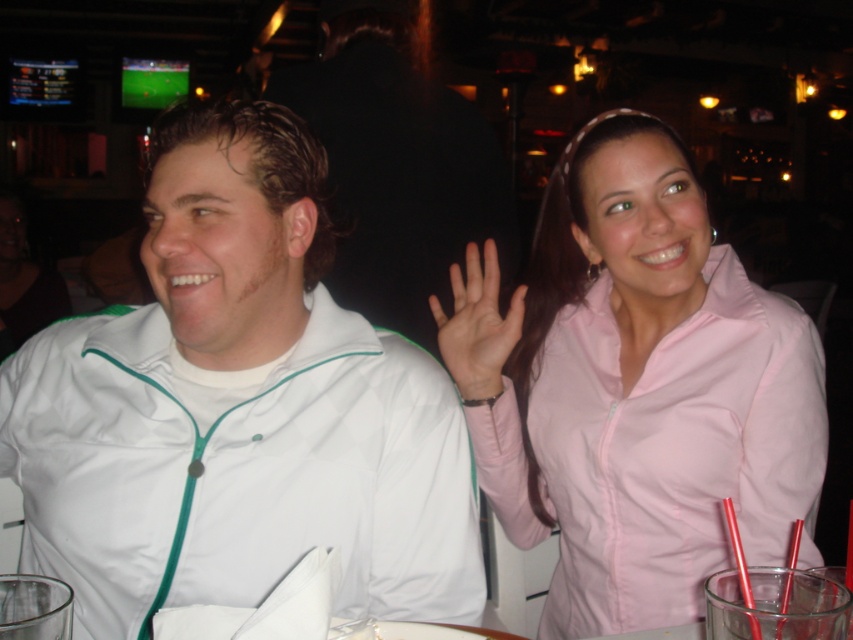
Question: Can you confirm if white matte jacket at left is smaller than pink matte hand at center?

Choices:
 (A) yes
 (B) no

Answer: (B)

Question: Estimate the real-world distances between objects in this image. Which object is closer to the pink zip-up jacket at upper right?

Choices:
 (A) white matte jacket at left
 (B) pink matte hand at center

Answer: (B)

Question: Does pink zip-up jacket at upper right appear over pink matte hand at center?

Choices:
 (A) yes
 (B) no

Answer: (B)

Question: Which point is closer to the camera?

Choices:
 (A) (91, 502)
 (B) (471, 256)
 (C) (489, 362)

Answer: (A)

Question: Which object is farther from the camera taking this photo?

Choices:
 (A) pink zip-up jacket at upper right
 (B) pink matte hand at center
 (C) white matte jacket at left

Answer: (B)

Question: Is white matte jacket at left to the right of pink matte hand at center from the viewer's perspective?

Choices:
 (A) yes
 (B) no

Answer: (B)